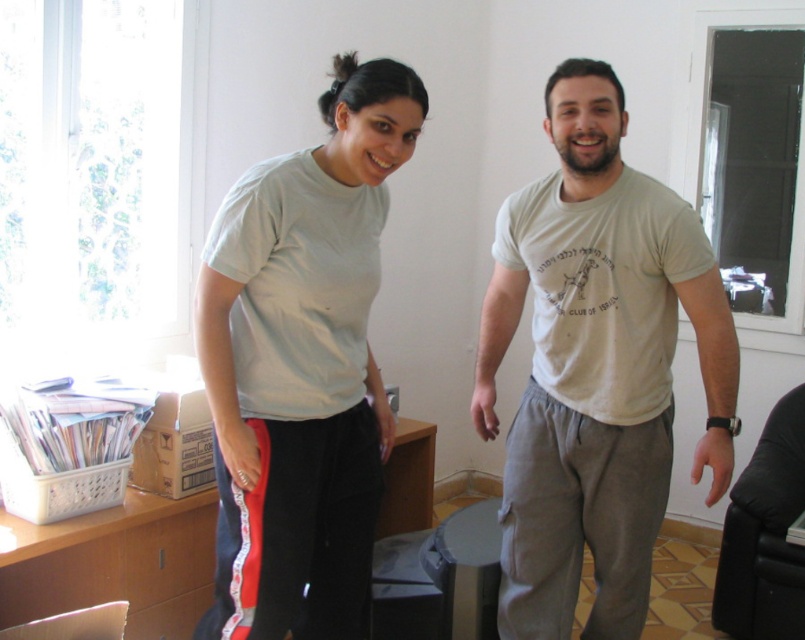
Question: Which point is closer to the camera taking this photo?

Choices:
 (A) click(x=713, y=392)
 (B) click(x=535, y=515)

Answer: (A)

Question: Considering the relative positions of light gray cotton t-shirt at center and light gray t-shirt at center in the image provided, where is light gray cotton t-shirt at center located with respect to light gray t-shirt at center?

Choices:
 (A) left
 (B) right

Answer: (B)

Question: Is the position of light gray cotton t-shirt at center more distant than that of light gray t-shirt at center?

Choices:
 (A) yes
 (B) no

Answer: (A)

Question: Does light gray cotton t-shirt at center have a larger size compared to light gray t-shirt at center?

Choices:
 (A) no
 (B) yes

Answer: (B)

Question: Which of the following is the farthest from the observer?

Choices:
 (A) (354, 372)
 (B) (622, 214)

Answer: (B)

Question: Which object is closer to the camera taking this photo?

Choices:
 (A) white cotton t-shirt at center
 (B) light gray cotton t-shirt at center

Answer: (A)